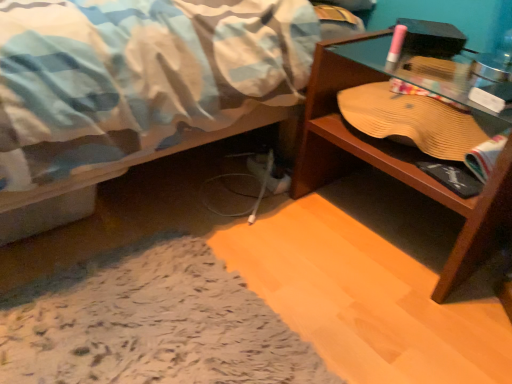
In order to click on vacant region in front of wooden desk at right in this screenshot , I will do (x=397, y=312).